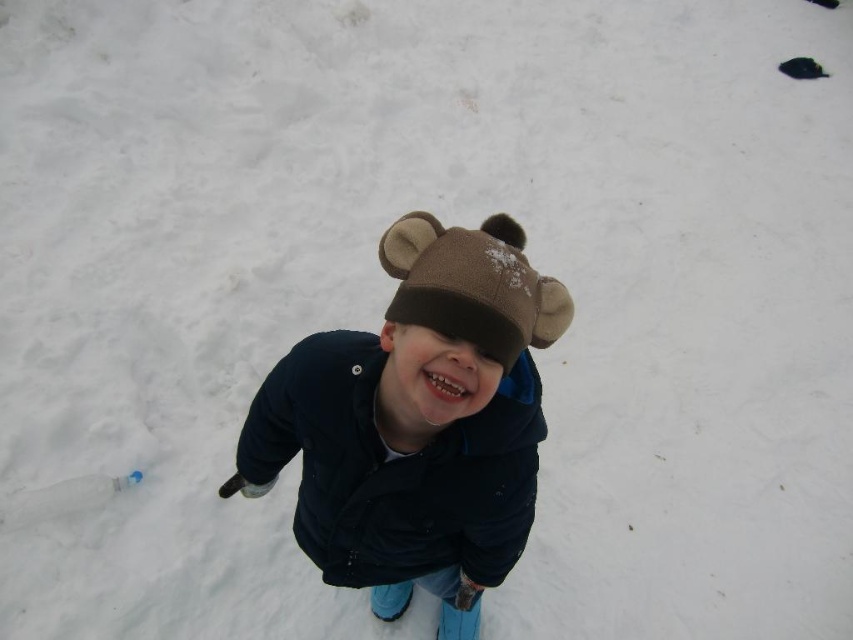
Question: Which of the following is the closest to the observer?

Choices:
 (A) brown fleece hat at center
 (B) dark blue fleece jacket at center

Answer: (A)

Question: Considering the relative positions of dark blue fleece jacket at center and brown fleece hat at center in the image provided, where is dark blue fleece jacket at center located with respect to brown fleece hat at center?

Choices:
 (A) left
 (B) right

Answer: (A)

Question: Is dark blue fleece jacket at center smaller than brown fleece hat at center?

Choices:
 (A) no
 (B) yes

Answer: (A)

Question: Is dark blue fleece jacket at center smaller than brown fleece hat at center?

Choices:
 (A) no
 (B) yes

Answer: (A)